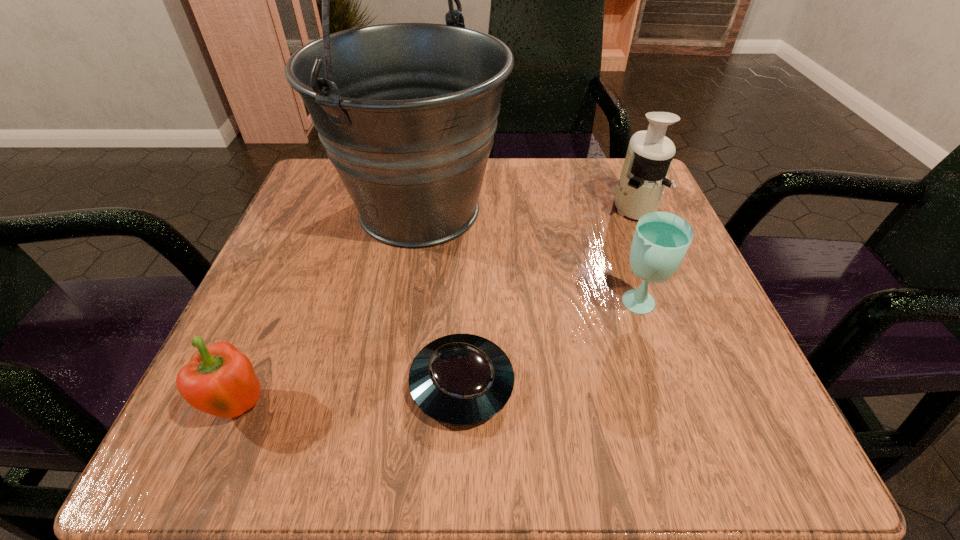
At what (x,y) coordinates should I click in order to perform the action: click on blank space that satisfies the following two spatial constraints: 1. on the back side of the fourth tallest object; 2. on the right side of the glass. Please return your answer as a coordinate pair (x, y). This screenshot has height=540, width=960. Looking at the image, I should click on (283, 306).

Where is `vacant space that satisfies the following two spatial constraints: 1. on the back side of the fourth tallest object; 2. on the left side of the juicer`? This screenshot has height=540, width=960. vacant space that satisfies the following two spatial constraints: 1. on the back side of the fourth tallest object; 2. on the left side of the juicer is located at coordinates (325, 206).

Locate an element on the screen. Image resolution: width=960 pixels, height=540 pixels. free region that satisfies the following two spatial constraints: 1. on the back side of the fourth tallest object; 2. on the left side of the third shortest object is located at coordinates (283, 306).